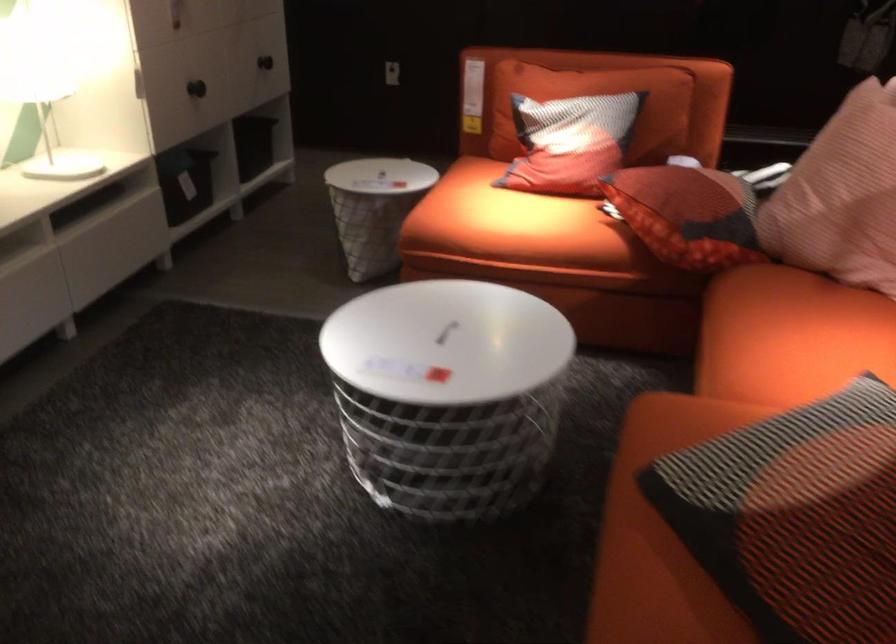
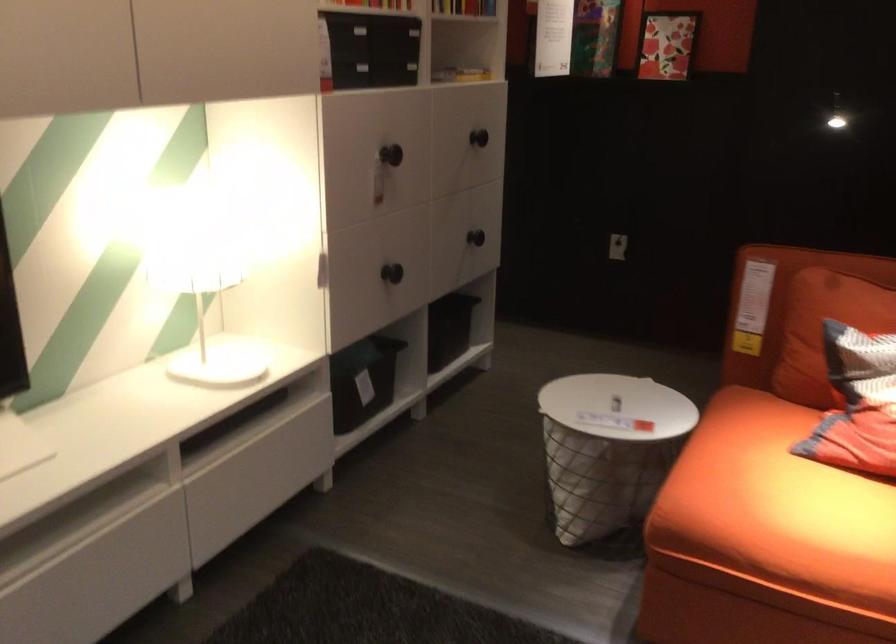
Question: The first image is from the beginning of the video and the second image is from the end. How did the camera likely rotate when shooting the video?

Choices:
 (A) Left
 (B) Right
 (C) Up
 (D) Down

Answer: (A)